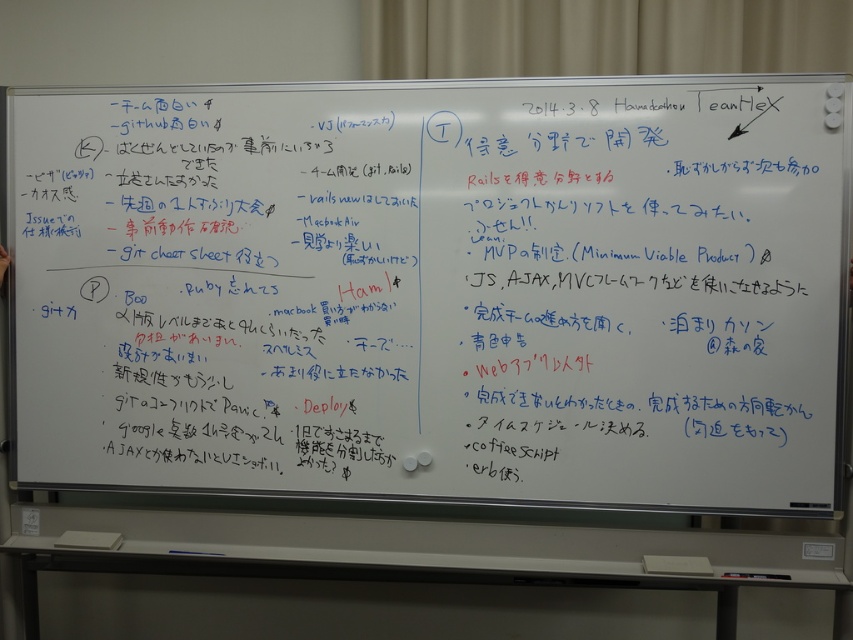
You are standing in front of the whiteboard at center and the white paper at bottom. Which object is closer to you?

The whiteboard at center is closer to you because it is in front of the white paper at bottom.

What is the exact position of the whiteboard at center?

The whiteboard at center is located at position point (434, 289).

What is located at the coordinates point (434,289)?

The whiteboard at center is located at point (434,289).